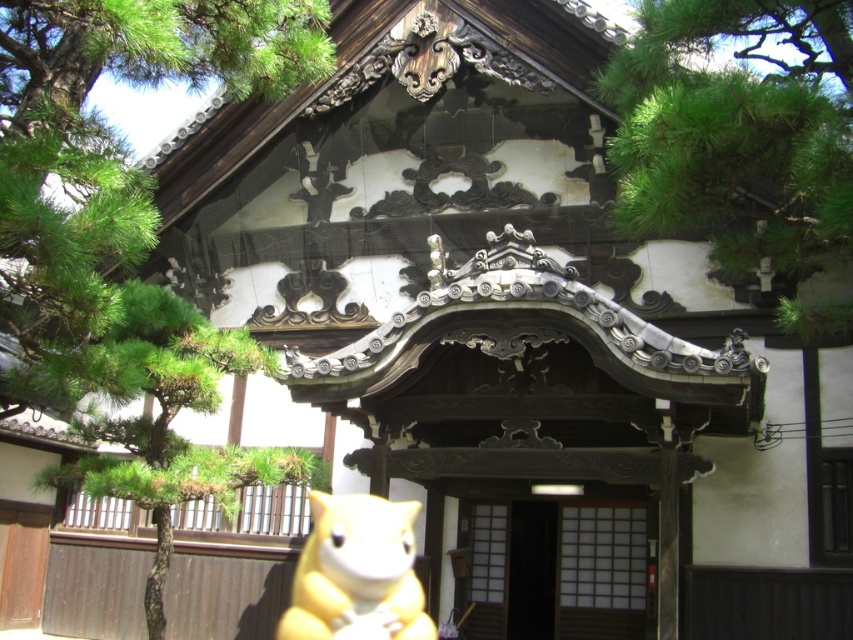
Question: Which object is farther from the camera taking this photo?

Choices:
 (A) yellow plush toy at lower center
 (B) green textured tree at left
 (C) green pine tree at upper left

Answer: (A)

Question: Which object is closer to the camera taking this photo?

Choices:
 (A) green pine tree at upper left
 (B) green leafy tree at upper right
 (C) green textured tree at left
 (D) yellow plush toy at lower center

Answer: (A)

Question: Is green pine tree at upper left behind green leafy tree at upper right?

Choices:
 (A) no
 (B) yes

Answer: (A)

Question: Which object appears closest to the camera in this image?

Choices:
 (A) green textured tree at left
 (B) yellow plush toy at lower center
 (C) green leafy tree at upper right
 (D) green pine tree at upper left

Answer: (D)

Question: In this image, where is green pine tree at upper left located relative to yellow plush toy at lower center?

Choices:
 (A) below
 (B) above

Answer: (B)

Question: Is green pine tree at upper left wider than green leafy tree at upper right?

Choices:
 (A) no
 (B) yes

Answer: (B)